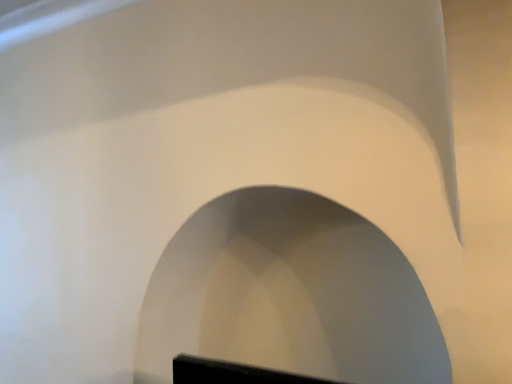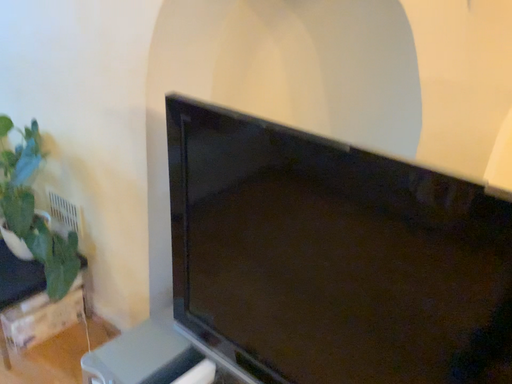
Question: Which way did the camera rotate in the video?

Choices:
 (A) rotated downward
 (B) rotated upward

Answer: (A)